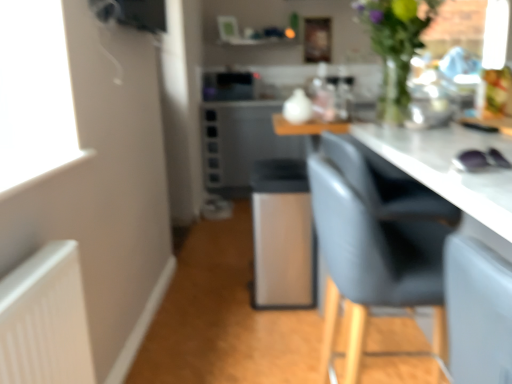
Identify the location of blank space to the left of satin silver bar stool at center. (210, 286).